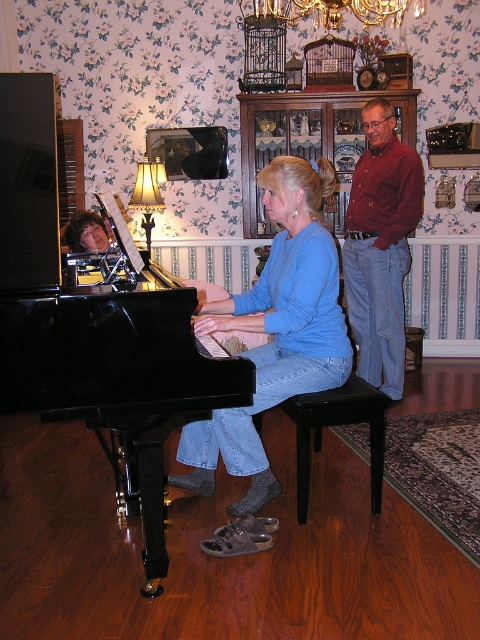
You are standing in the living room and want to move from the black glossy piano at left to the red shirt at right. Which direction should you move towards?

You should move towards the right direction because the black glossy piano at left is to the left of the red shirt at right.

You are a photographer positioned to the right of the scene. You want to capture a photo that includes both the black glossy piano at left and the blue cotton shirt at center. Which direction should you move to ensure both objects are in frame?

Since the black glossy piano at left is to the left of the blue cotton shirt at center, you should move to the left to include both objects in your frame.